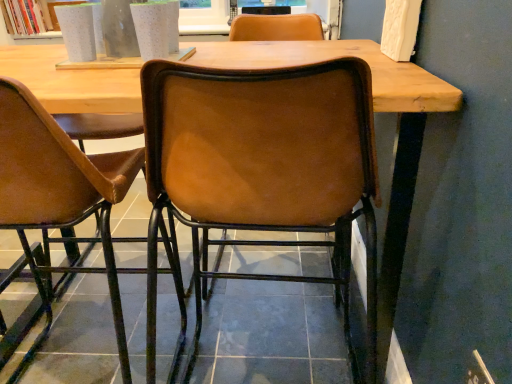
Question: From their relative heights in the image, would you say leather at center, which appears as the 1th chair when viewed from the right, is taller or shorter than brown leather chair at center, which ranks as the 2th chair in right-to-left order?

Choices:
 (A) tall
 (B) short

Answer: (A)

Question: In the image, is leather at center, the 2th chair viewed from the left, on the left side or the right side of brown leather chair at center, the 1th chair in the left-to-right sequence?

Choices:
 (A) left
 (B) right

Answer: (B)

Question: Is leather at center, which appears as the 1th chair when viewed from the right, inside or outside of brown leather chair at center, which ranks as the 2th chair in right-to-left order?

Choices:
 (A) inside
 (B) outside

Answer: (B)

Question: Looking at their shapes, would you say brown leather chair at center, which ranks as the 2th chair in right-to-left order, is wider or thinner than leather at center, the 2th chair viewed from the left?

Choices:
 (A) wide
 (B) thin

Answer: (A)

Question: In terms of size, does brown leather chair at center, which ranks as the 2th chair in right-to-left order, appear bigger or smaller than leather at center, the 2th chair viewed from the left?

Choices:
 (A) small
 (B) big

Answer: (B)

Question: Relative to leather at center, which appears as the 1th chair when viewed from the right, is brown leather chair at center, which ranks as the 2th chair in right-to-left order, in front or behind?

Choices:
 (A) front
 (B) behind

Answer: (B)

Question: Is brown leather chair at center, which ranks as the 2th chair in right-to-left order, taller or shorter than leather at center, the 2th chair viewed from the left?

Choices:
 (A) tall
 (B) short

Answer: (B)